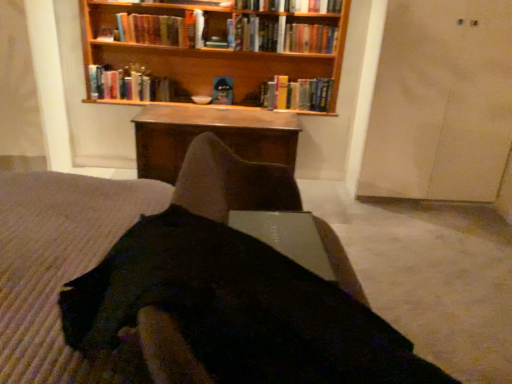
This screenshot has width=512, height=384. Identify the location of free spot above hardcover book at upper center, marked as the 5th book in a right-to-left arrangement (from a real-world perspective). (148, 13).